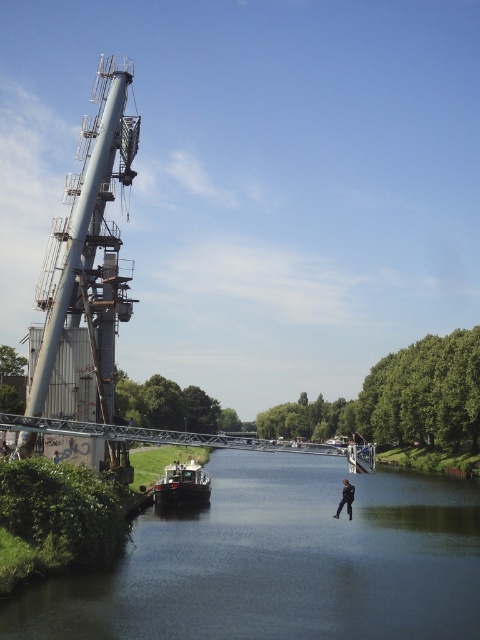
Question: Is dark blue water at center further to the viewer compared to dark blue jeans at lower center?

Choices:
 (A) no
 (B) yes

Answer: (A)

Question: Is dark brown wooden boat at center smaller than dark blue jeans at lower center?

Choices:
 (A) yes
 (B) no

Answer: (A)

Question: Which point is closer to the camera?

Choices:
 (A) dark blue jeans at lower center
 (B) gray metallic tower at left
 (C) dark brown wooden boat at center
 (D) dark blue water at center

Answer: (D)

Question: Can you confirm if dark blue water at center is positioned above dark brown wooden boat at center?

Choices:
 (A) no
 (B) yes

Answer: (A)

Question: Which object is positioned closest to the dark brown wooden boat at center?

Choices:
 (A) dark blue water at center
 (B) dark blue jeans at lower center
 (C) gray metallic tower at left

Answer: (B)

Question: Which point is closer to the camera taking this photo?

Choices:
 (A) (348, 508)
 (B) (171, 476)
 (C) (63, 260)

Answer: (A)